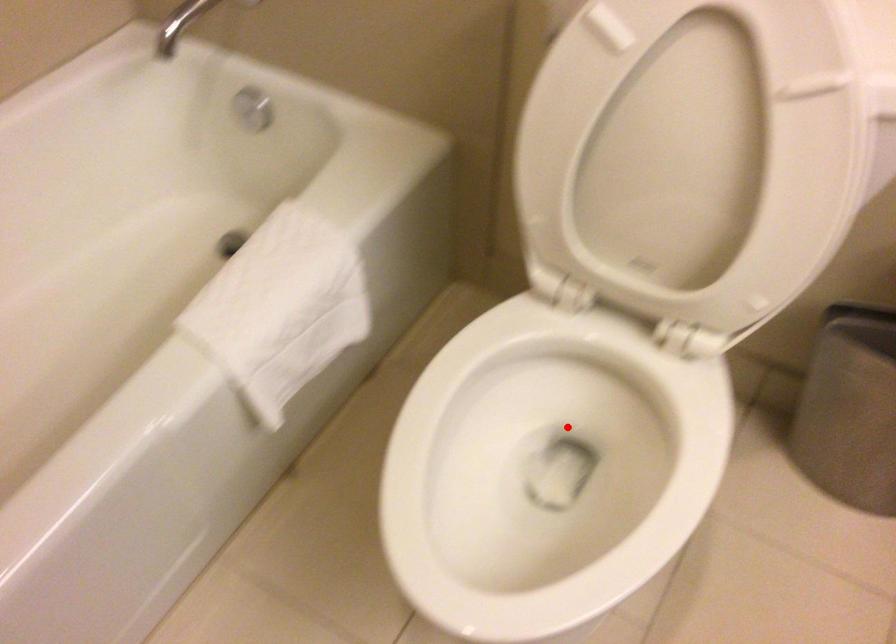
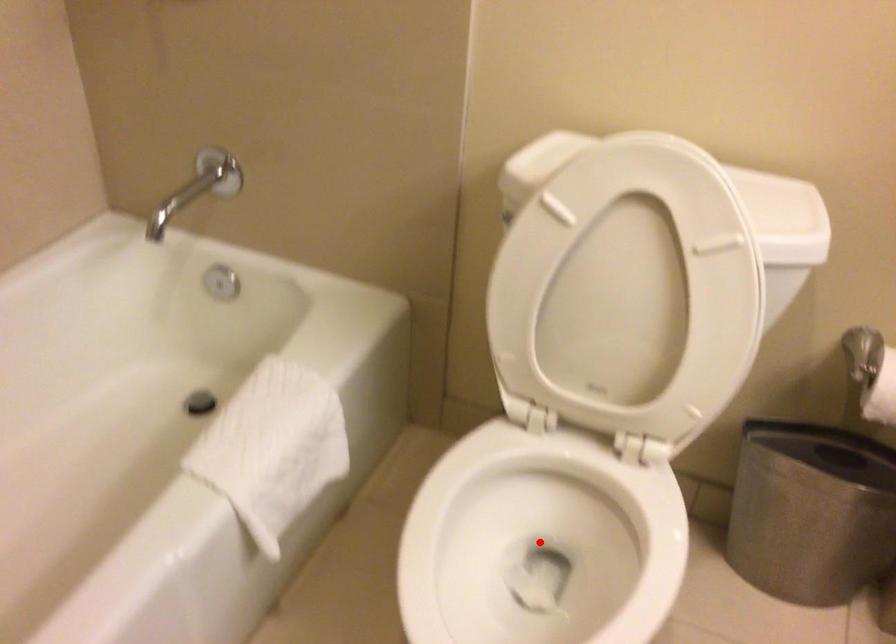
From the picture: I am providing you with two images of the same scene from different viewpoints. A red point is marked on the first image and another point is marked on the second image. Is the red point in image1 aligned with the point shown in image2?

A: Yes